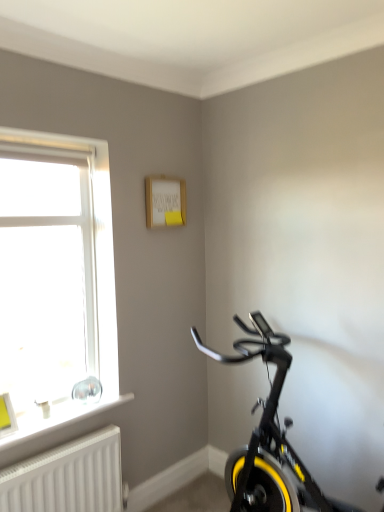
Question: Is black matte exercise bike at lower right further to camera compared to white textured radiator at lower left?

Choices:
 (A) no
 (B) yes

Answer: (A)

Question: Considering the relative sizes of black matte exercise bike at lower right and white textured radiator at lower left in the image provided, is black matte exercise bike at lower right thinner than white textured radiator at lower left?

Choices:
 (A) yes
 (B) no

Answer: (B)

Question: Is black matte exercise bike at lower right bigger than white textured radiator at lower left?

Choices:
 (A) yes
 (B) no

Answer: (A)

Question: Considering the relative sizes of black matte exercise bike at lower right and white textured radiator at lower left in the image provided, is black matte exercise bike at lower right taller than white textured radiator at lower left?

Choices:
 (A) no
 (B) yes

Answer: (B)

Question: Would you say black matte exercise bike at lower right contains white textured radiator at lower left?

Choices:
 (A) no
 (B) yes

Answer: (A)

Question: Is black matte exercise bike at lower right closer to the viewer compared to white textured radiator at lower left?

Choices:
 (A) yes
 (B) no

Answer: (A)

Question: Is white plastic window at left oriented away from yellow rubber bicycle wheel at lower right?

Choices:
 (A) no
 (B) yes

Answer: (A)

Question: Does white plastic window at left touch yellow rubber bicycle wheel at lower right?

Choices:
 (A) no
 (B) yes

Answer: (A)

Question: Considering the relative positions of white plastic window at left and yellow rubber bicycle wheel at lower right in the image provided, is white plastic window at left to the right of yellow rubber bicycle wheel at lower right from the viewer's perspective?

Choices:
 (A) no
 (B) yes

Answer: (A)

Question: Is white plastic window at left further to camera compared to yellow rubber bicycle wheel at lower right?

Choices:
 (A) yes
 (B) no

Answer: (B)

Question: Can you confirm if white plastic window at left is smaller than yellow rubber bicycle wheel at lower right?

Choices:
 (A) no
 (B) yes

Answer: (A)

Question: Can yellow rubber bicycle wheel at lower right be found inside white plastic window at left?

Choices:
 (A) no
 (B) yes

Answer: (A)

Question: Is white plastic window sill at lower left facing away from yellow rubber bicycle wheel at lower right?

Choices:
 (A) yes
 (B) no

Answer: (B)